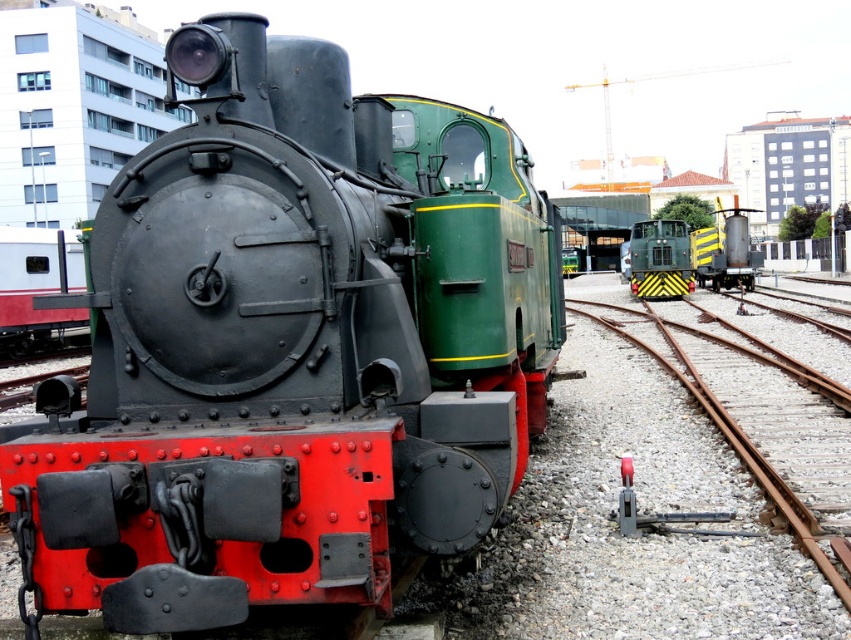
Question: Among these points, which one is farthest from the camera?

Choices:
 (A) (770, 442)
 (B) (290, 109)
 (C) (677, 273)

Answer: (C)

Question: Is matte black locomotive at center behind rusty metal train track at center?

Choices:
 (A) yes
 (B) no

Answer: (B)

Question: Is rusty metal train track at center further to camera compared to green/yellow striped train at center?

Choices:
 (A) no
 (B) yes

Answer: (A)

Question: From the image, what is the correct spatial relationship of matte black locomotive at center in relation to rusty metal train track at center?

Choices:
 (A) above
 (B) below

Answer: (A)

Question: Which of the following is the farthest from the observer?

Choices:
 (A) matte black locomotive at center
 (B) green/yellow striped train at center

Answer: (B)

Question: Which point appears closest to the camera in this image?

Choices:
 (A) coord(780,488)
 (B) coord(223,220)

Answer: (B)